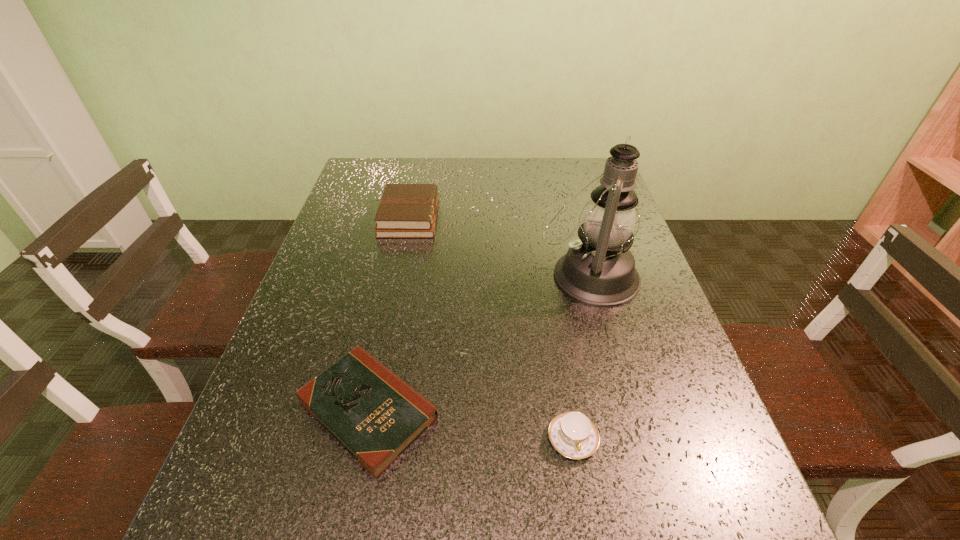
The width and height of the screenshot is (960, 540). In order to click on vacant space located on the right of the shortest object in this screenshot , I will do `click(588, 409)`.

The height and width of the screenshot is (540, 960). Identify the location of object present at the right edge. (599, 270).

The height and width of the screenshot is (540, 960). In the image, there is a desktop. What are the coordinates of `blank space at the far edge` in the screenshot? It's located at (529, 166).

What are the coordinates of `vacant position at the left edge of the desktop` in the screenshot? It's located at (318, 275).

Image resolution: width=960 pixels, height=540 pixels. In the image, there is a desktop. Identify the location of vacant space at the right edge. (707, 403).

Identify the location of free space at the far left corner of the desktop. (398, 171).

Where is `vacant space at the far right corner of the desktop`? The image size is (960, 540). vacant space at the far right corner of the desktop is located at coordinates (562, 164).

I want to click on vacant space that's between the farthest object and the nearer Bible, so click(x=389, y=313).

Where is `vacant area that lies between the teacup and the farthest object`? This screenshot has width=960, height=540. vacant area that lies between the teacup and the farthest object is located at coordinates (491, 328).

At what (x,y) coordinates should I click in order to perform the action: click on vacant region between the farther Bible and the oil lamp. Please return your answer as a coordinate pair (x, y). The width and height of the screenshot is (960, 540). Looking at the image, I should click on (499, 246).